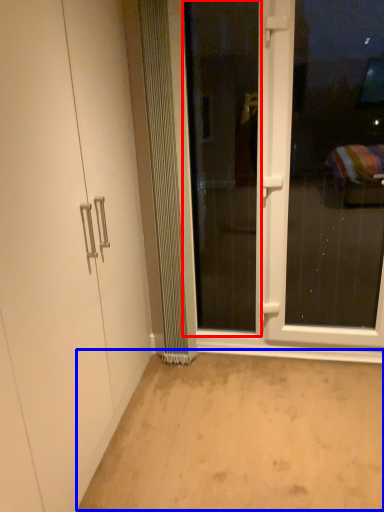
Question: Which object appears farthest to the camera in this image, screen door (highlighted by a red box) or plain (highlighted by a blue box)?

Choices:
 (A) screen door
 (B) plain

Answer: (A)